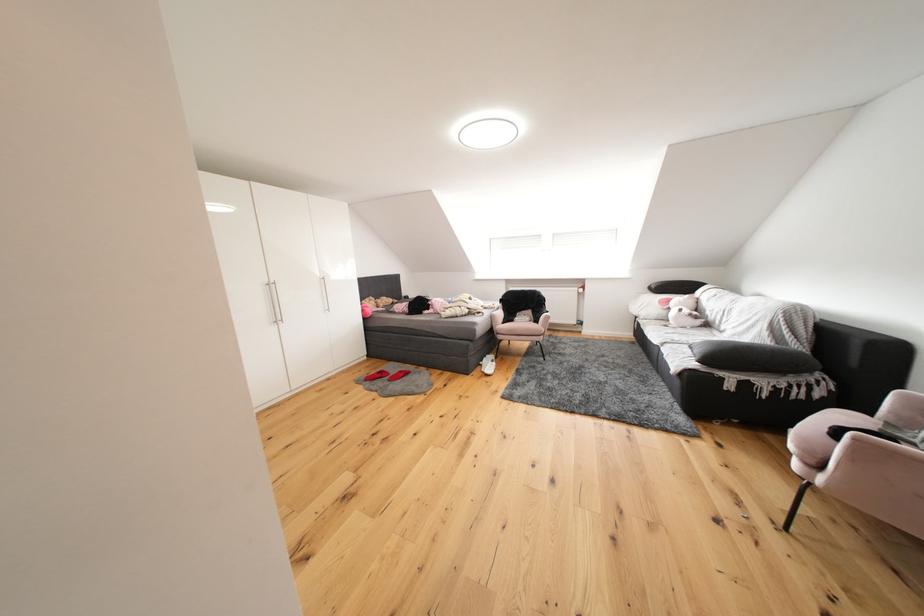
Where would you sit the pink chair sitting surface? Please return your answer as a coordinate pair (x, y).

(825, 435)